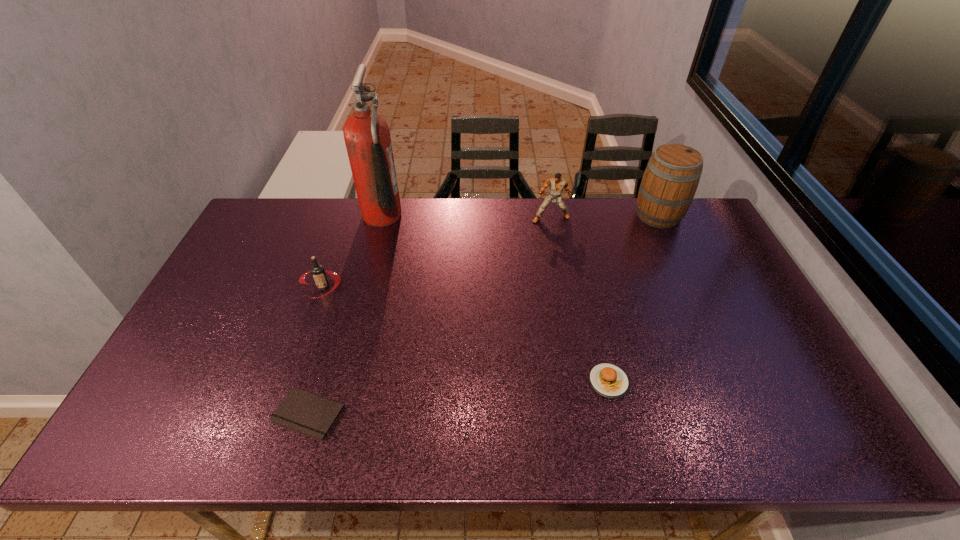
In order to click on vacant region at the far edge of the desktop in this screenshot , I will do `click(551, 206)`.

You are a GUI agent. You are given a task and a screenshot of the screen. Output one action in this format:
    pyautogui.click(x=<x>, y=<y>)
    Task: Click on the vacant space at the left edge of the desktop
    
    Given the screenshot: What is the action you would take?
    pyautogui.click(x=217, y=346)

The width and height of the screenshot is (960, 540). I want to click on vacant space at the right edge, so click(x=693, y=271).

You are a GUI agent. You are given a task and a screenshot of the screen. Output one action in this format:
    pyautogui.click(x=<x>, y=<y>)
    Task: Click on the free space at the far right corner of the desktop
    This screenshot has width=960, height=540.
    Given the screenshot: What is the action you would take?
    pyautogui.click(x=687, y=218)

Where is `free spot between the fire extinguisher and the third shortest object`? The image size is (960, 540). free spot between the fire extinguisher and the third shortest object is located at coordinates (352, 251).

Locate an element on the screen. This screenshot has height=540, width=960. vacant point located between the cider and the tallest object is located at coordinates (520, 215).

Identify the location of vacant space that is in between the shortest object and the rightmost object. This screenshot has width=960, height=540. (484, 314).

Identify the location of free space between the shortest object and the third nearest object. The image size is (960, 540). tap(316, 350).

The width and height of the screenshot is (960, 540). Identify the location of free spot between the third nearest object and the rightmost object. (491, 251).

This screenshot has height=540, width=960. Find the location of `vacant space that's between the shortest object and the third nearest object`. vacant space that's between the shortest object and the third nearest object is located at coordinates (316, 350).